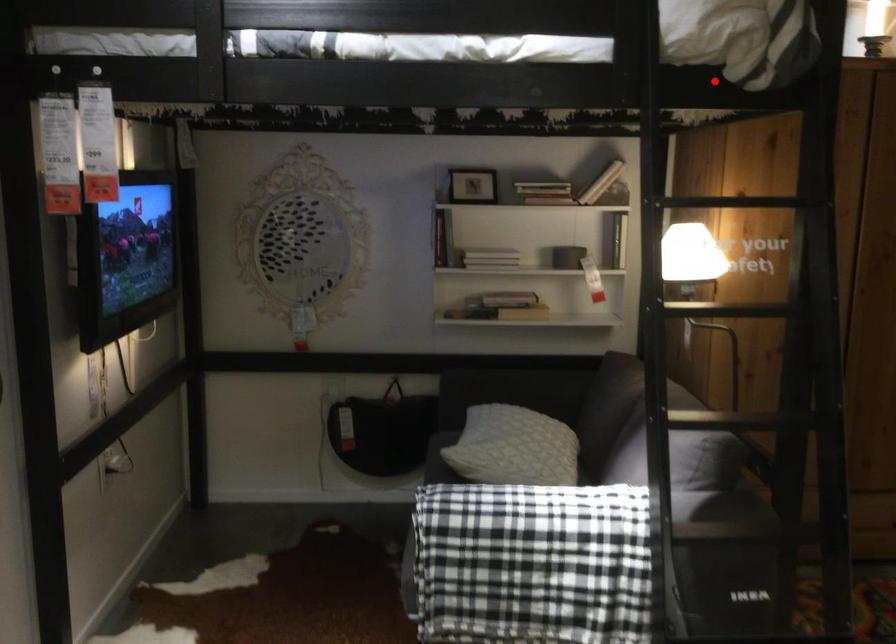
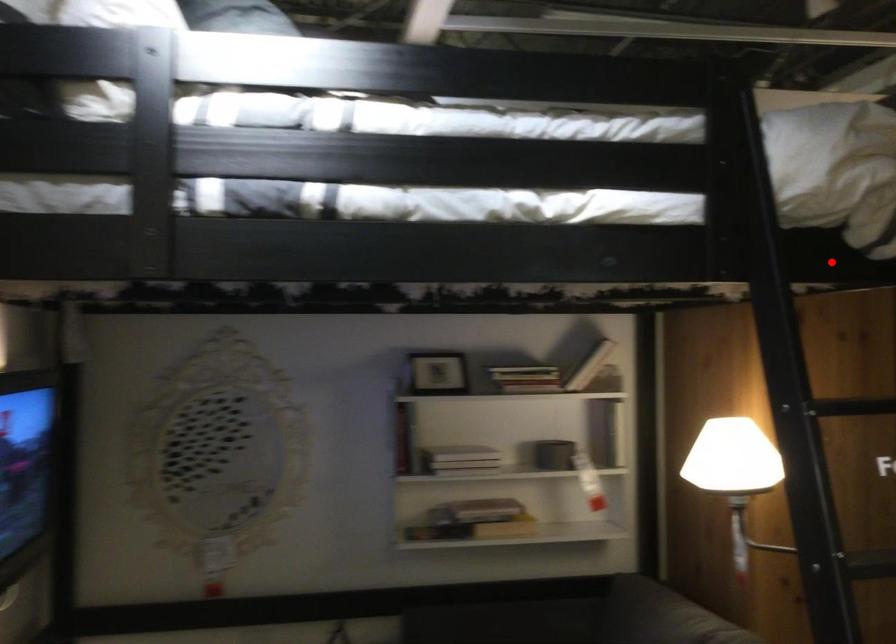
I am providing you with two images of the same scene from different viewpoints. A red point is marked on the first image and another point is marked on the second image. Do the highlighted points in image1 and image2 indicate the same real-world spot?

Yes